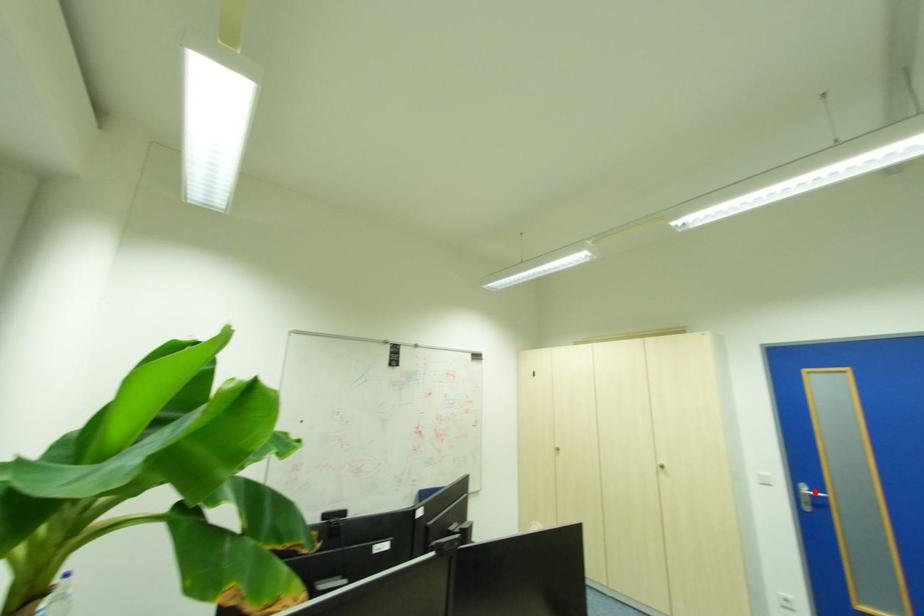
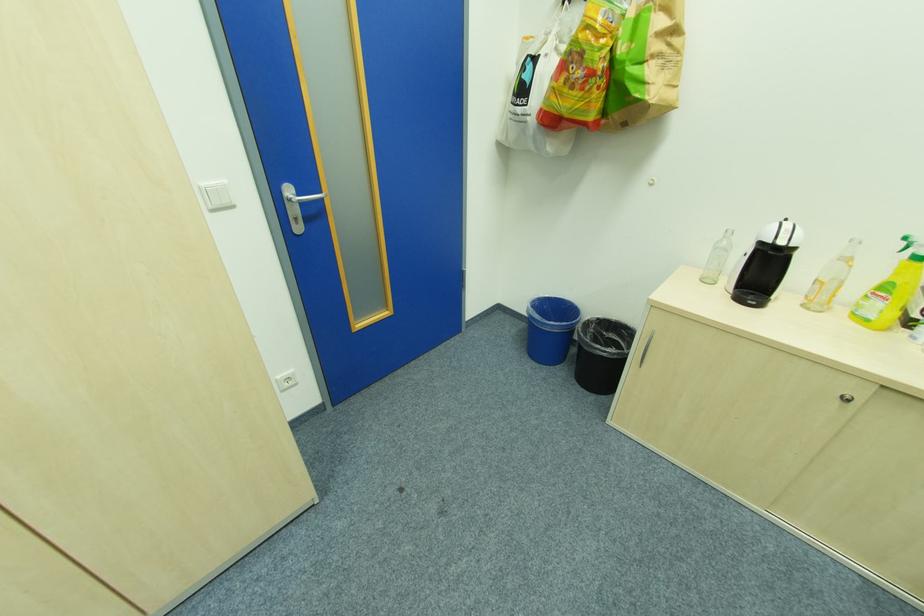
Find the pixel in the second image that matches the highlighted location in the first image.

(304, 196)